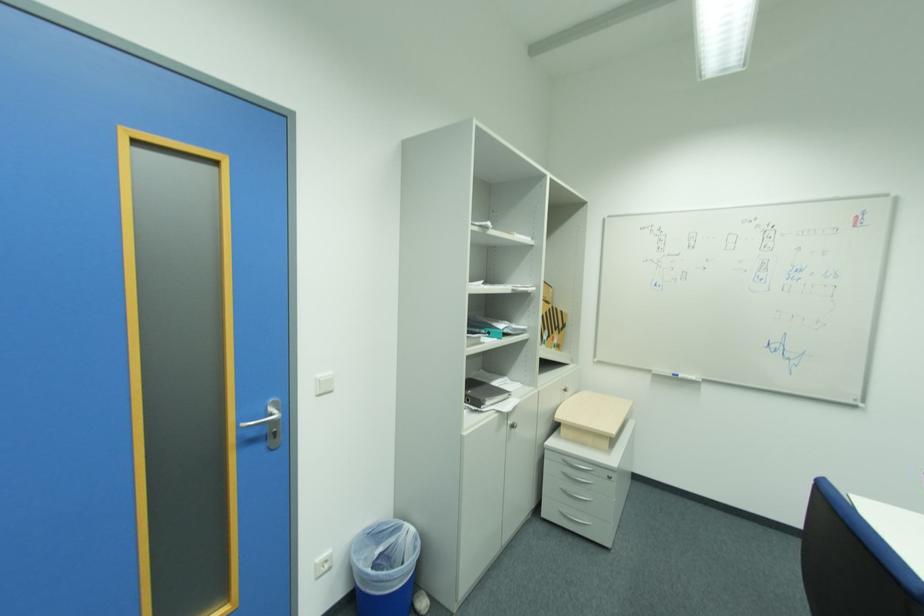
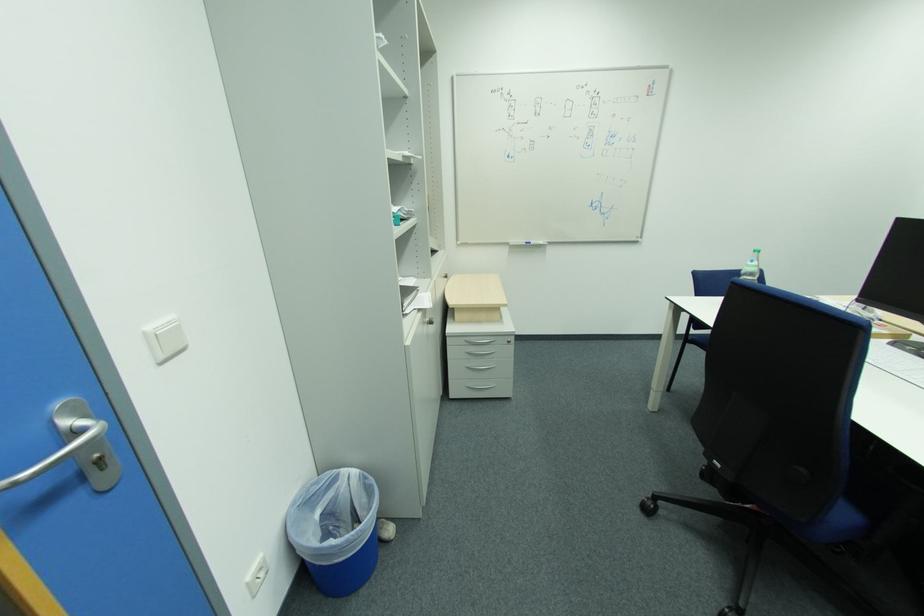
Find the pixel in the second image that matches [323,377] in the first image.

(154, 329)